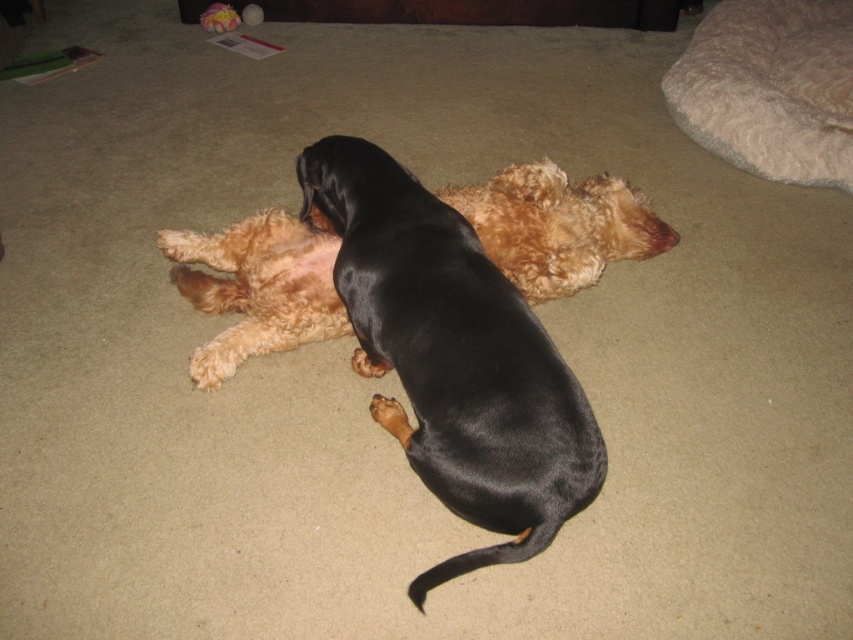
You are standing in the room where the black shiny dog at center is lying. If you want to place a toy exactly where the dog is, what coordinates should you aim for?

You should aim for the coordinates point (453, 356) where the black shiny dog at center is located.

Looking at this image, you are a pet owner who wants to place a new toy between the shiny black coat at center and the fluffy beige dog bed at upper right. Based on their sizes, which object will the toy be closer to?

The shiny black coat at center is shorter than the fluffy beige dog bed at upper right, so the toy will be closer to the shiny black coat at center.